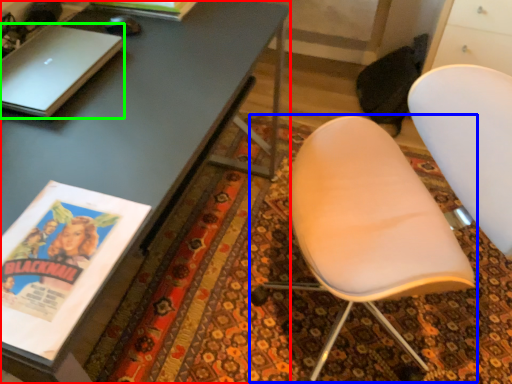
Question: Which object is positioned farthest from desk (highlighted by a red box)? Select from chair (highlighted by a blue box) and laptop (highlighted by a green box).

Choices:
 (A) chair
 (B) laptop

Answer: (A)